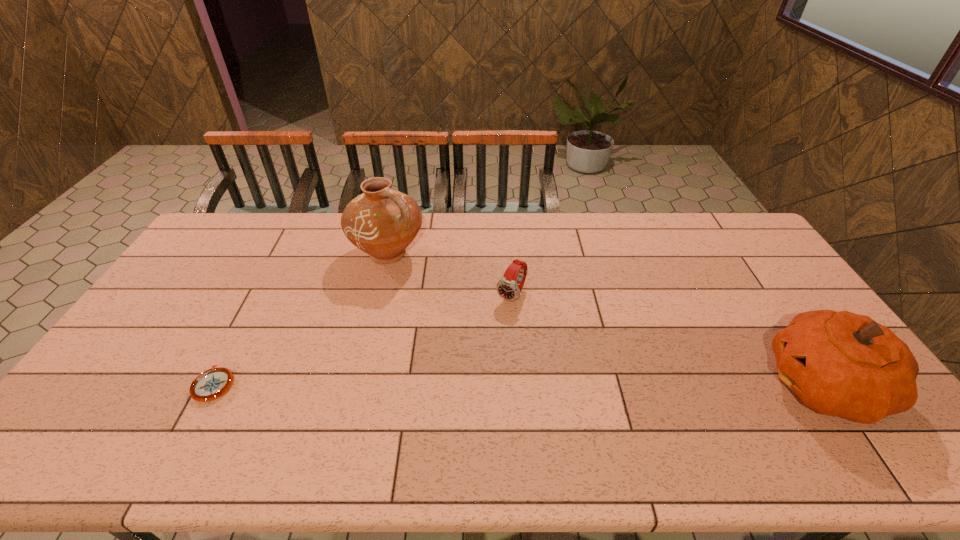
Identify the location of the leftmost object. (213, 383).

At what (x,y) coordinates should I click in order to perform the action: click on compass. Please return your answer as a coordinate pair (x, y). Image resolution: width=960 pixels, height=540 pixels. Looking at the image, I should click on (213, 383).

I want to click on the rightmost object, so click(842, 364).

Image resolution: width=960 pixels, height=540 pixels. I want to click on the third shortest object, so click(x=842, y=364).

Identify the location of the third nearest object. This screenshot has width=960, height=540. (507, 287).

Identify the location of watch. The image size is (960, 540). (507, 287).

The height and width of the screenshot is (540, 960). I want to click on the farthest object, so click(x=382, y=222).

Locate an element on the screen. This screenshot has height=540, width=960. the second object from left to right is located at coordinates (382, 222).

You are a GUI agent. You are given a task and a screenshot of the screen. Output one action in this format:
    pyautogui.click(x=<x>, y=<y>)
    Task: Click on the free spot located 0.180m on the right of the shortest object
    Image resolution: width=960 pixels, height=540 pixels.
    Given the screenshot: What is the action you would take?
    pyautogui.click(x=303, y=384)

Identify the location of free space located on the front-facing side of the rightmost object. This screenshot has width=960, height=540. (616, 384).